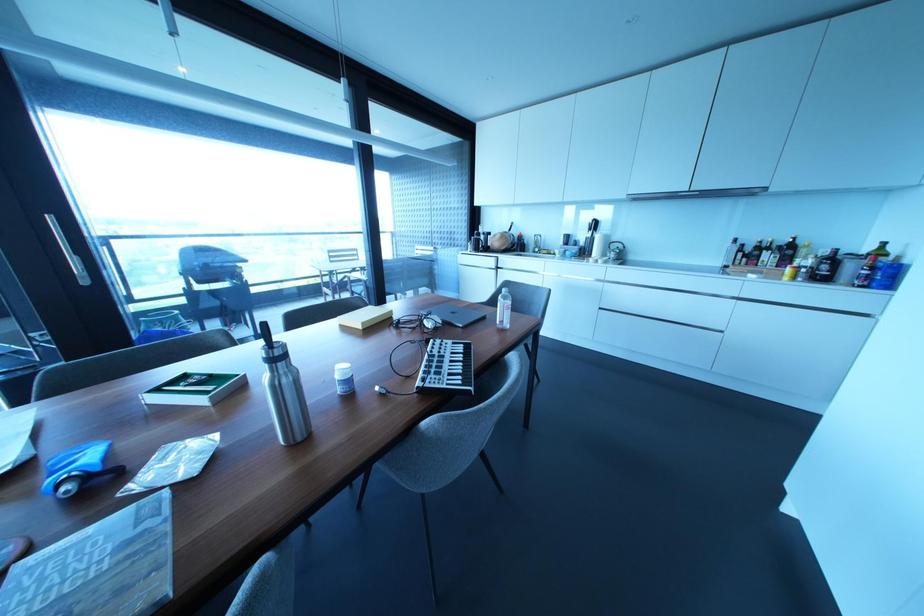
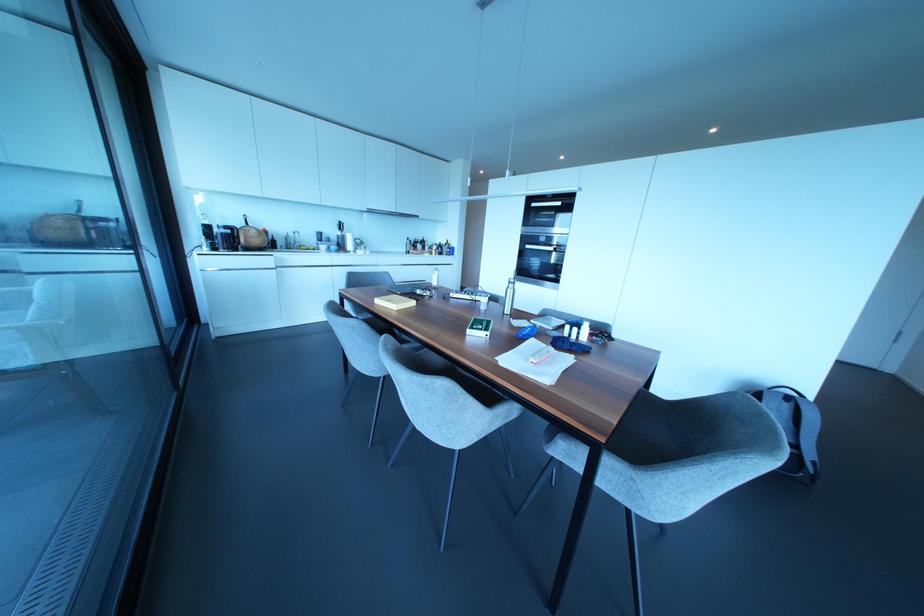
Where in the second image is the point corresponding to the point at 497,321 from the first image?

(434, 283)